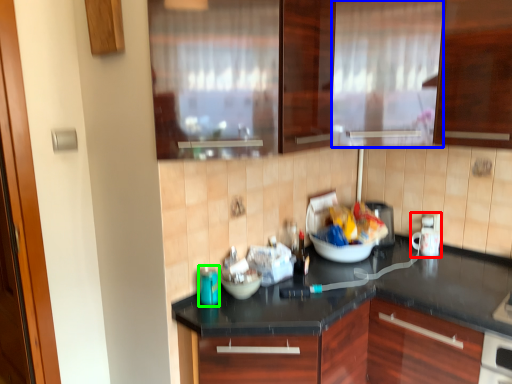
Question: Based on their relative distances, which object is farther from appliance (highlighted by a red box)? Choose from curtain (highlighted by a blue box) and appliance (highlighted by a green box).

Choices:
 (A) curtain
 (B) appliance

Answer: (B)